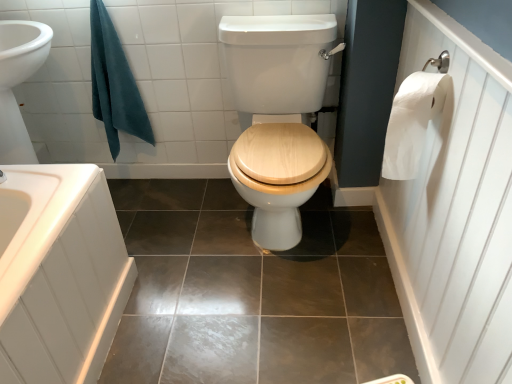
Where is `free point below white wood toilet seat at center (from a real-world perspective)`? This screenshot has height=384, width=512. free point below white wood toilet seat at center (from a real-world perspective) is located at coordinates (281, 247).